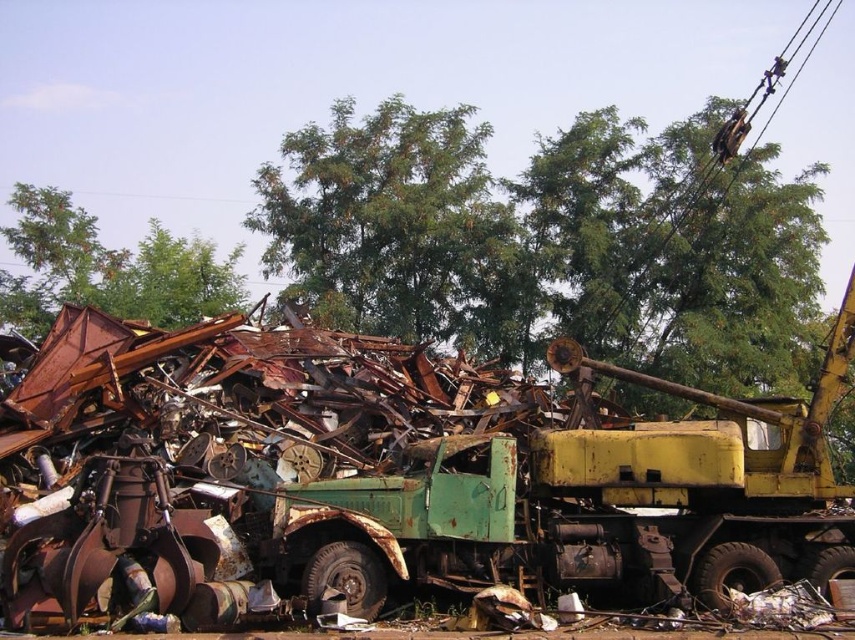
You are a worker at the recycling facility. You need to move the rusty metal tow truck at center and the green leafy tree at upper left. Which object requires more space to move due to its larger width?

The green leafy tree at upper left requires more space to move because it has a greater width than the rusty metal tow truck at center.

You are a worker at the recycling facility and need to determine the visibility of the trees. Which tree, the green leafy tree at upper center or the green leafy tree at upper left, is more visible from your current position?

The green leafy tree at upper center is more visible because it is positioned in front of the green leafy tree at upper left, making it closer to your viewpoint.

Based on the photo, you are a worker at the recycling facility and need to determine which object is taller between the rusty metal tow truck at center and the green leafy tree at upper center. Based on the scene, which one is taller?

The green leafy tree at upper center is taller than the rusty metal tow truck at center.